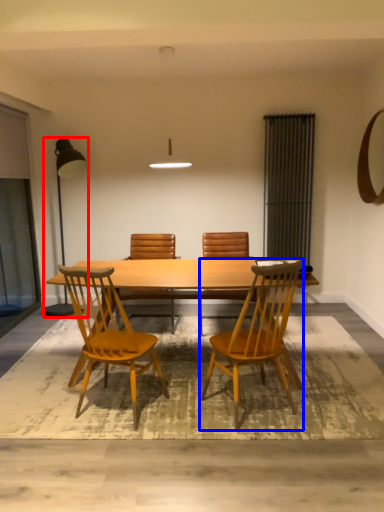
Question: Which object appears farthest to the camera in this image, lamp (highlighted by a red box) or chair (highlighted by a blue box)?

Choices:
 (A) lamp
 (B) chair

Answer: (A)